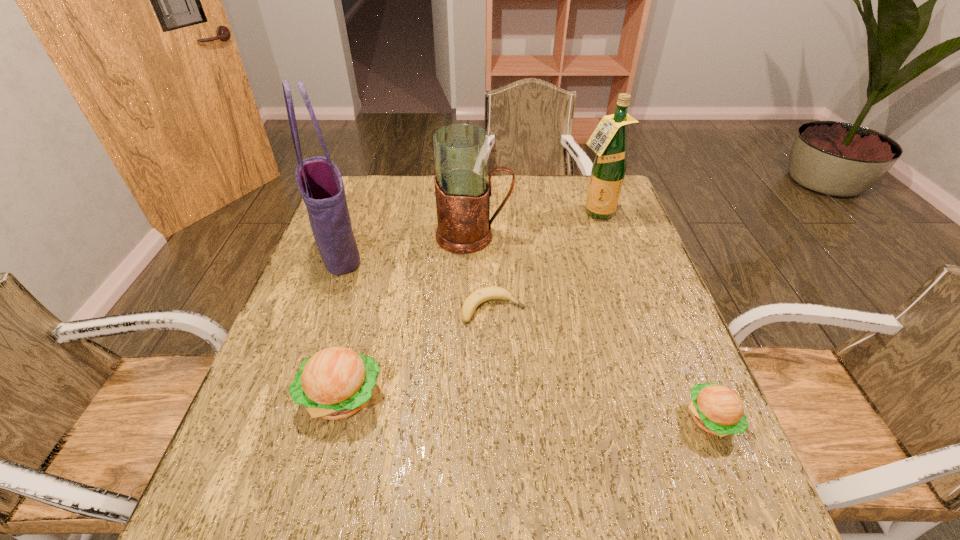
Identify the location of object present at the near left corner. This screenshot has width=960, height=540. (335, 383).

The height and width of the screenshot is (540, 960). I want to click on object present at the far right corner, so (x=608, y=141).

This screenshot has height=540, width=960. I want to click on object at the near right corner, so click(x=716, y=409).

Locate an element on the screen. The width and height of the screenshot is (960, 540). vacant space at the far edge of the desktop is located at coordinates (433, 190).

Find the location of a particular element. free space at the left edge of the desktop is located at coordinates (324, 335).

Where is `vacant space at the right edge of the desktop`? The height and width of the screenshot is (540, 960). vacant space at the right edge of the desktop is located at coordinates (609, 323).

Locate an element on the screen. The height and width of the screenshot is (540, 960). free space at the near left corner of the desktop is located at coordinates (239, 426).

Identify the location of free space at the near right corner of the desktop. The image size is (960, 540). (670, 429).

Where is `vacant area that lies between the fourth shortest object and the tote bag`? vacant area that lies between the fourth shortest object and the tote bag is located at coordinates (406, 245).

Where is `vacant space that is in between the tote bag and the pitcher`? vacant space that is in between the tote bag and the pitcher is located at coordinates point(406,245).